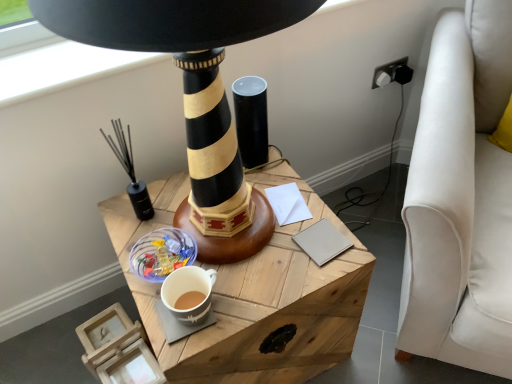
Locate an element on the screen. Image resolution: width=512 pixels, height=384 pixels. vacant area situated to the left side of beige leather notepad at center, placed as the 1th notepad when sorted from front to back is located at coordinates (269, 257).